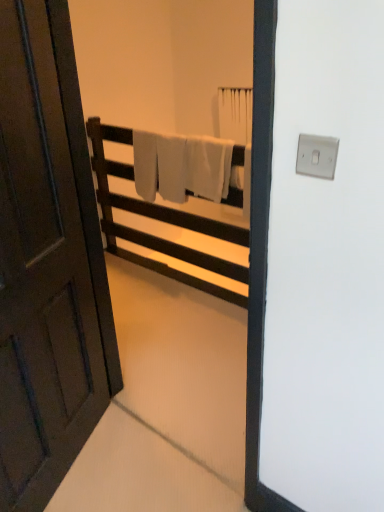
This screenshot has height=512, width=384. Find the location of `free region under white matte towel rack at center (from a real-world perspective)`. free region under white matte towel rack at center (from a real-world perspective) is located at coordinates coord(152,267).